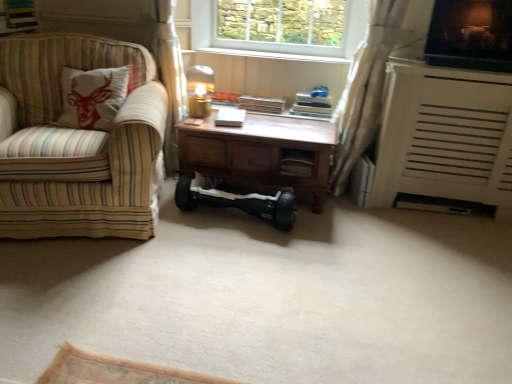
Where is `free space in front of black rubber hoverboard at center`? Image resolution: width=512 pixels, height=384 pixels. free space in front of black rubber hoverboard at center is located at coordinates (227, 264).